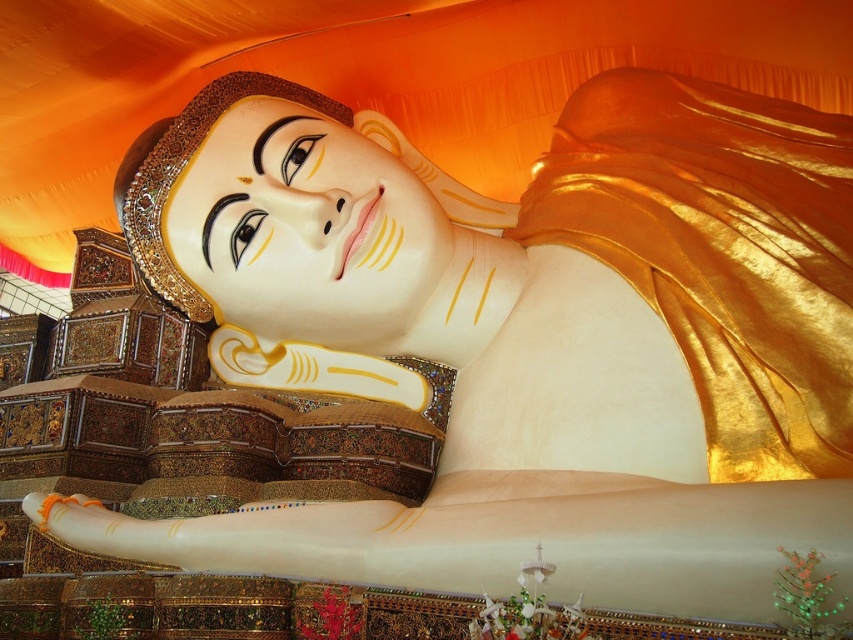
Question: Which point is closer to the camera?

Choices:
 (A) matte gold face at center
 (B) gold shiny cloth at upper right

Answer: (B)

Question: Among these objects, which one is nearest to the camera?

Choices:
 (A) matte gold face at center
 (B) gold shiny cloth at upper right

Answer: (B)

Question: Where is gold shiny cloth at upper right located in relation to matte gold face at center in the image?

Choices:
 (A) above
 (B) below

Answer: (B)

Question: Does gold shiny cloth at upper right appear on the right side of matte gold face at center?

Choices:
 (A) yes
 (B) no

Answer: (A)

Question: Considering the relative positions of gold shiny cloth at upper right and matte gold face at center in the image provided, where is gold shiny cloth at upper right located with respect to matte gold face at center?

Choices:
 (A) left
 (B) right

Answer: (B)

Question: Which of the following is the farthest from the observer?

Choices:
 (A) gold shiny cloth at upper right
 (B) matte gold face at center

Answer: (B)